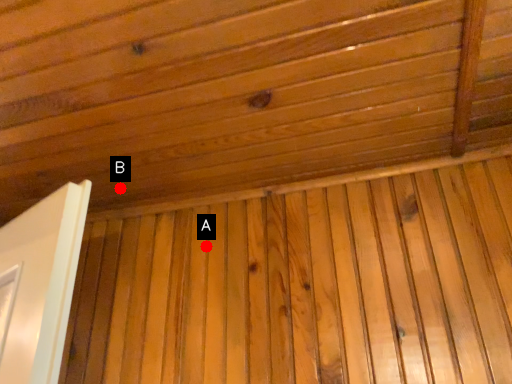
Question: Two points are circled on the image, labeled by A and B beside each circle. Which of the following is the closest to the observer?

Choices:
 (A) A is closer
 (B) B is closer

Answer: (A)